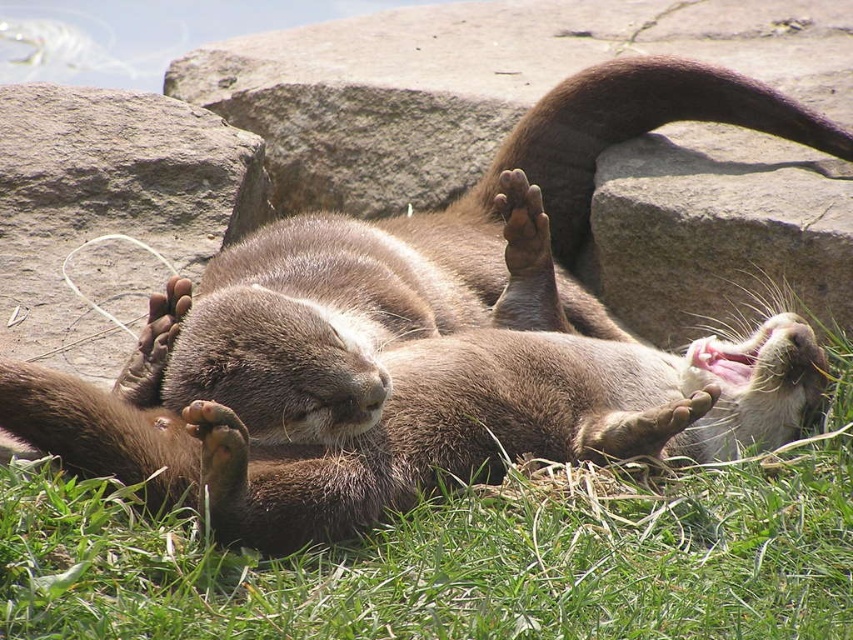
Can you confirm if green soft grass at lower center is bigger than brown furry paw at center?

Indeed, green soft grass at lower center has a larger size compared to brown furry paw at center.

Can you confirm if green soft grass at lower center is positioned to the left of brown furry paw at center?

No, green soft grass at lower center is not to the left of brown furry paw at center.

This screenshot has width=853, height=640. What do you see at coordinates (462, 556) in the screenshot?
I see `green soft grass at lower center` at bounding box center [462, 556].

At what (x,y) coordinates should I click in order to perform the action: click on green soft grass at lower center. Please return your answer as a coordinate pair (x, y). Looking at the image, I should click on (462, 556).

Is green soft grass at lower center bigger than gray rock at upper center?

Yes.

The image size is (853, 640). What do you see at coordinates (462, 556) in the screenshot? I see `green soft grass at lower center` at bounding box center [462, 556].

What are the coordinates of `green soft grass at lower center` in the screenshot? It's located at (462, 556).

Is gray rock at upper center shorter than brown furry paw at center?

No, gray rock at upper center is not shorter than brown furry paw at center.

How much distance is there between gray rock at upper center and brown furry paw at center?

gray rock at upper center is 28.91 inches away from brown furry paw at center.

Where is `gray rock at upper center`? gray rock at upper center is located at coordinates (x=109, y=212).